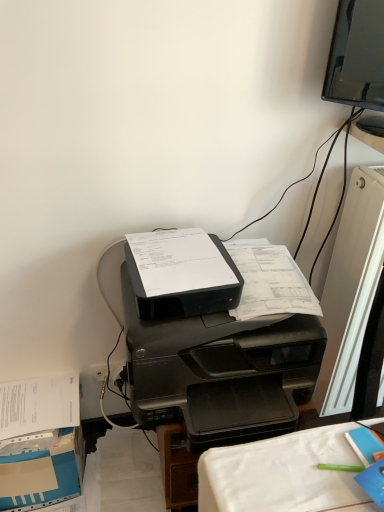
Where is `empty space that is ontop of black plastic printer at center (from a real-world perspective)`? empty space that is ontop of black plastic printer at center (from a real-world perspective) is located at coordinates pyautogui.click(x=249, y=289).